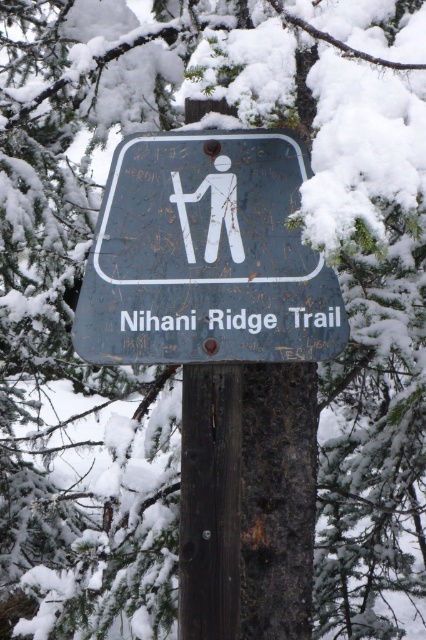
You are a hiker trying to read the Nihani Ridge Trail sign. Which object is closer to you, the matte blue sign at center or the brown wood post at center?

The matte blue sign at center is closer to the viewer than the brown wood post at center, so the matte blue sign at center is closer to you.

You are a hiker trying to read the trail name on the matte blue sign at center. Since the brown wood post at center is taller, will you have to look up or down to see the sign?

The matte blue sign at center is not as tall as the brown wood post at center, so you will have to look down to see the sign.

You are a hiker trying to read the Nihani Ridge Trail sign. The sign is partially covered in snow. Can you see the brown wood post at center through the snow covering the matte blue sign at center?

The matte blue sign at center is above the brown wood post at center, so the snow covering the matte blue sign at center might block your view of the brown wood post at center unless the snow has cleared areas.